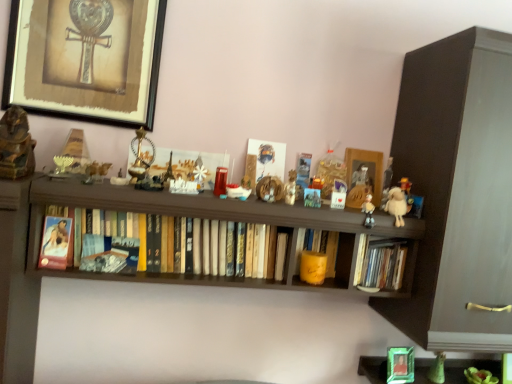
Question: Considering their positions, is fluffy beige stuffed animal at right located in front of or behind hardcover books at center, the 1th book positioned from the left?

Choices:
 (A) behind
 (B) front

Answer: (A)

Question: Is fluffy beige stuffed animal at right wider or thinner than hardcover books at center, the 1th book positioned from the left?

Choices:
 (A) thin
 (B) wide

Answer: (A)

Question: Which object is positioned closest to the dark wood cabinet at right?

Choices:
 (A) fluffy beige stuffed animal at right
 (B) brown wooden shelf at center
 (C) wooden picture frame at center, which appears as the first picture frame when ordered from the bottom
 (D) metallic framed artwork at upper left, which is counted as the 2th picture frame, starting from the bottom
 (E) matte paper photo frame at left

Answer: (A)

Question: Based on their relative distances, which object is nearer to the matte paper photo frame at left?

Choices:
 (A) dark wood cabinet at right
 (B) metallic framed artwork at upper left, which is counted as the 2th picture frame, starting from the bottom
 (C) brown wooden shelf at center
 (D) hardcover book at center, acting as the third book starting from the left
 (E) wooden picture frame at center, the second picture frame in the left-to-right sequence

Answer: (C)